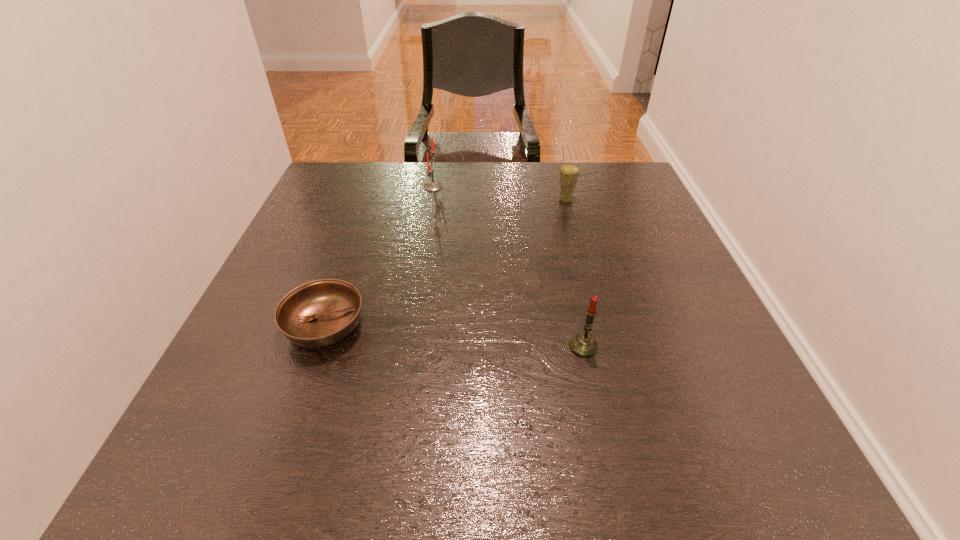
Identify which object is located as the third nearest to the left candle. Please provide its 2D coordinates. Your answer should be formatted as a tuple, i.e. [(x, y)], where the tuple contains the x and y coordinates of a point satisfying the conditions above.

[(583, 344)]

Where is `free space that satisfies the following two spatial constraints: 1. on the back side of the straw for drinking; 2. on the front-facing side of the farther candle`? The width and height of the screenshot is (960, 540). free space that satisfies the following two spatial constraints: 1. on the back side of the straw for drinking; 2. on the front-facing side of the farther candle is located at coordinates (562, 187).

You are a GUI agent. You are given a task and a screenshot of the screen. Output one action in this format:
    pyautogui.click(x=<x>, y=<y>)
    Task: Click on the free location that satisfies the following two spatial constraints: 1. on the front-facing side of the left candle; 2. on the back side of the straw for drinking
    
    Given the screenshot: What is the action you would take?
    pyautogui.click(x=431, y=200)

Locate an element on the screen. Image resolution: width=960 pixels, height=540 pixels. vacant point that satisfies the following two spatial constraints: 1. on the front-facing side of the third object from right to left; 2. on the front side of the shortest object is located at coordinates (412, 326).

In order to click on free spot that satisfies the following two spatial constraints: 1. on the front-facing side of the left candle; 2. on the front side of the shortest object in this screenshot , I will do `click(412, 326)`.

Locate an element on the screen. Image resolution: width=960 pixels, height=540 pixels. free point that satisfies the following two spatial constraints: 1. on the front-facing side of the left candle; 2. on the right side of the straw for drinking is located at coordinates (431, 200).

Locate an element on the screen. free space that satisfies the following two spatial constraints: 1. on the front-facing side of the nearer candle; 2. on the right side of the second object from left to right is located at coordinates (409, 347).

The image size is (960, 540). In order to click on free spot that satisfies the following two spatial constraints: 1. on the front-facing side of the left candle; 2. on the back side of the straw for drinking in this screenshot , I will do 431,200.